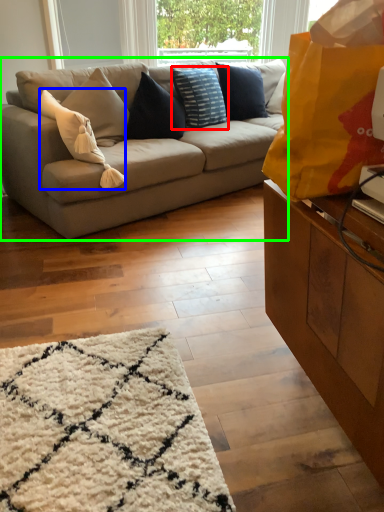
Question: Estimate the real-world distances between objects in this image. Which object is closer to pillow (highlighted by a red box), pillow (highlighted by a blue box) or studio couch (highlighted by a green box)?

Choices:
 (A) pillow
 (B) studio couch

Answer: (B)